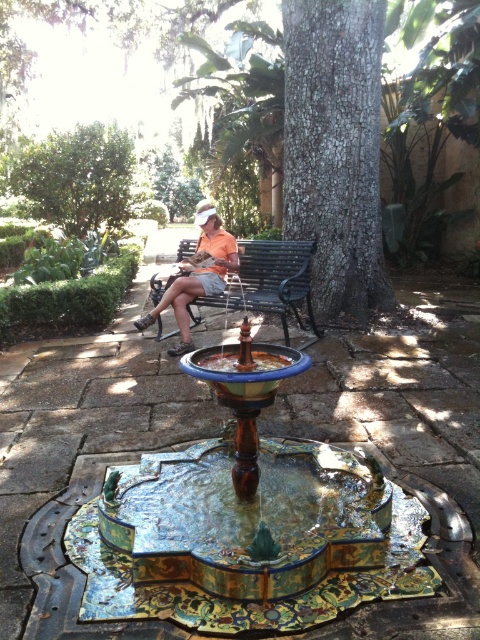
Question: Does black metal bench at center come in front of matte orange shirt at center?

Choices:
 (A) no
 (B) yes

Answer: (B)

Question: Estimate the real-world distances between objects in this image. Which object is closer to the brown rough bark tree at center?

Choices:
 (A) black metal bench at center
 (B) shiny ceramic fountain at center
 (C) matte orange shirt at center
 (D) green leafy tree at upper left

Answer: (A)

Question: Which point is closer to the camera?

Choices:
 (A) shiny ceramic fountain at center
 (B) black metal bench at center
 (C) matte orange shirt at center
 (D) green leafy tree at upper left

Answer: (A)

Question: Is shiny ceramic fountain at center positioned in front of matte orange shirt at center?

Choices:
 (A) yes
 (B) no

Answer: (A)

Question: Which point is closer to the camera taking this photo?

Choices:
 (A) (332, 20)
 (B) (96, 157)
 (C) (193, 292)

Answer: (C)

Question: Does shiny ceramic fountain at center have a smaller size compared to green leafy tree at upper left?

Choices:
 (A) yes
 (B) no

Answer: (A)